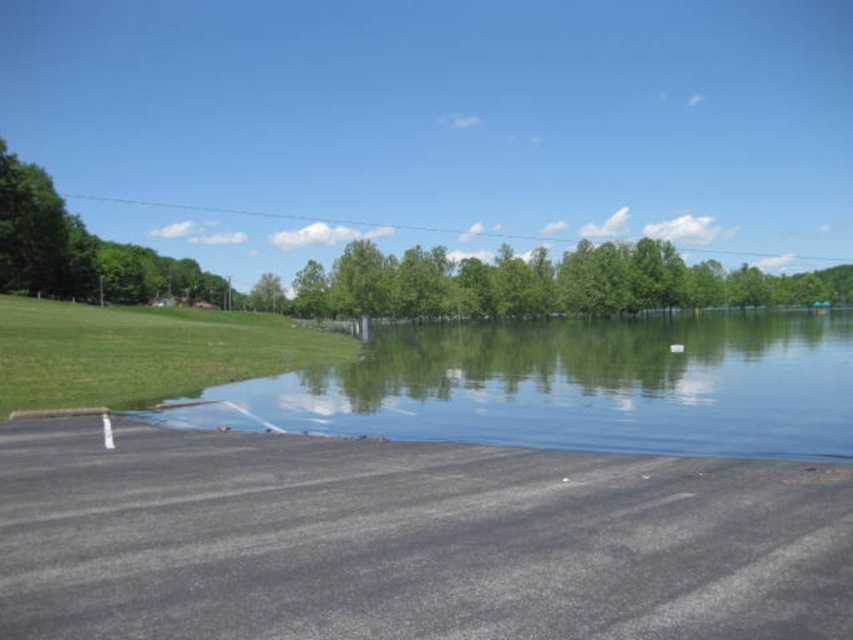
You are a photographer trying to capture the reflection of the green leafy trees at center in the clear water at lower center. Based on the scene, will the reflection be visible?

The clear water at lower center is positioned under green leafy trees at center, so the reflection of the green leafy trees at center should be visible in the clear water at lower center since the water is calm and reflective.

From the picture: You are standing at the edge of the submerged parking lot and see two points marked on the asphalt. The first point is at coordinates point(552, 333) and the second at point(556, 278). If you want to walk from the first point to the second point, in which direction should you move relative to the parking lot?

To move from point(552, 333) to point(556, 278), you should walk towards the left since point(552, 333) is in front of point(556, 278).